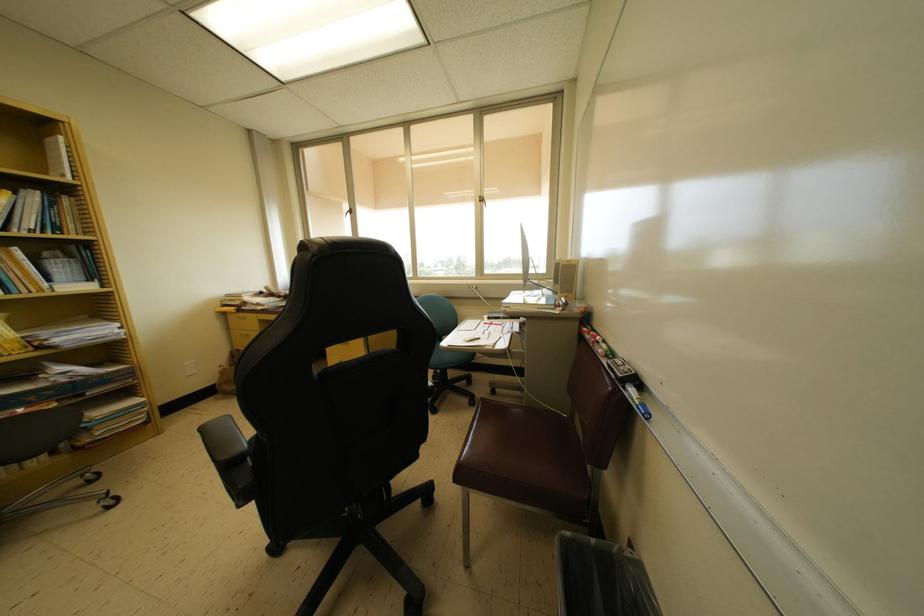
Find where to turn the window handle. Please return your answer as a coordinate pair (x, y).

(347, 209)